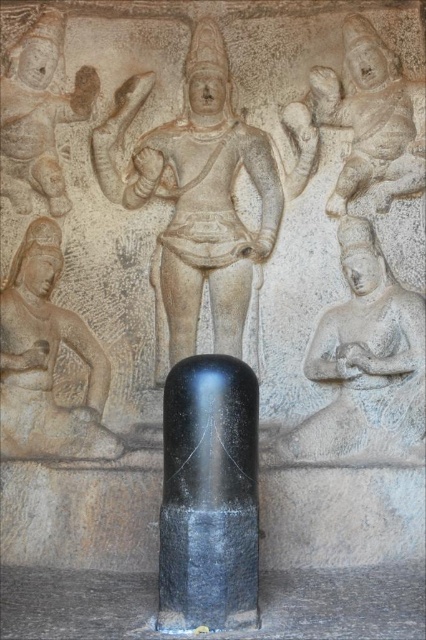
Question: Does black polished pillar at center lie behind matte gray statue at lower left?

Choices:
 (A) yes
 (B) no

Answer: (B)

Question: Is stone statue at center closer to the viewer compared to black polished pillar at center?

Choices:
 (A) no
 (B) yes

Answer: (A)

Question: Which of the following is the closest to the observer?

Choices:
 (A) gray stone figure at upper right
 (B) matte stone figure at upper left

Answer: (B)

Question: Which of the following is the closest to the observer?

Choices:
 (A) matte gray statue at lower left
 (B) gray stone carving at center
 (C) matte stone figure at upper left
 (D) black polished pillar at center

Answer: (D)

Question: Which object is the farthest from the stone statue at center?

Choices:
 (A) matte stone figure at upper left
 (B) gray stone figure at upper right

Answer: (B)

Question: Is stone statue at center positioned before gray stone figure at upper right?

Choices:
 (A) no
 (B) yes

Answer: (B)